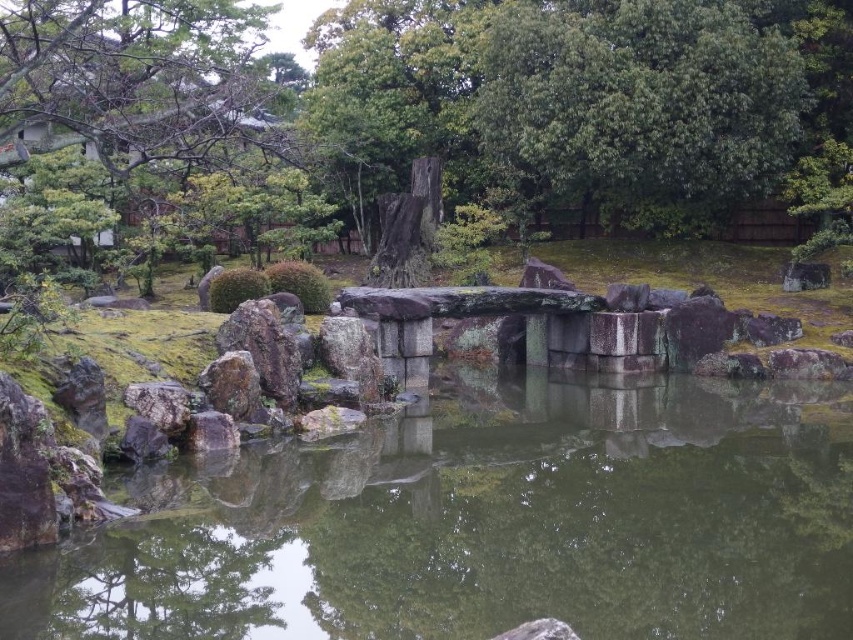
You are standing in the Japanese garden and want to reach the point marked by the coordinates point (753, 611). The stone bridge at center is in your way. Can you walk around the bridge to reach the point?

The point (753, 611) is 12.30 meters away from the viewer, so you can walk around the stone bridge at center to reach it since the distance allows for maneuvering around the obstacle.

You are standing at the point marked as point (74, 109) in a Japanese garden. You want to take a photo of the stone bridge and the pond. Considering your current position, will you be able to capture both the stone bridge and the pond in a single frame without moving? Please explain your reasoning.

The point marked as point (74, 109) is 36.87 meters away from the viewer. Since the stone bridge is at the center of the pond and the viewer is positioned at a considerable distance, it is likely possible to capture both the stone bridge and the pond in a single frame without moving. The distance allows for a wide enough angle to include both elements in the composition.